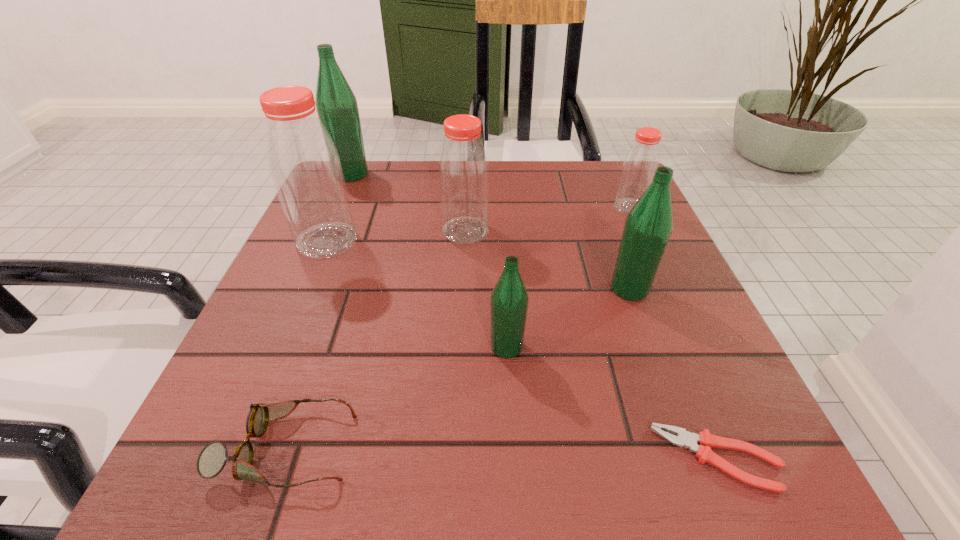
The width and height of the screenshot is (960, 540). In order to click on spectacles in this screenshot , I will do `click(212, 459)`.

You are a GUI agent. You are given a task and a screenshot of the screen. Output one action in this format:
    pyautogui.click(x=<x>, y=<y>)
    Task: Click on the shortest object
    The width and height of the screenshot is (960, 540).
    Given the screenshot: What is the action you would take?
    pyautogui.click(x=706, y=440)

What are the coordinates of `free point located on the right of the farthest object` in the screenshot? It's located at (437, 174).

Where is `vacant area located on the back of the leftmost red bottle`? vacant area located on the back of the leftmost red bottle is located at coordinates (357, 169).

I want to click on vacant area located 0.060m on the right of the second nearest green bottle, so click(683, 289).

The image size is (960, 540). Find the location of `free space located 0.240m on the left of the second biggest red bottle`. free space located 0.240m on the left of the second biggest red bottle is located at coordinates (328, 231).

Image resolution: width=960 pixels, height=540 pixels. I want to click on vacant space located on the front of the seventh nearest object, so click(692, 344).

Identify the location of free spot located on the back of the third nearest object. (501, 244).

The width and height of the screenshot is (960, 540). Identify the location of vacant space located 0.290m on the front-facing side of the spectacles. (572, 448).

Where is `vacant area located 0.320m on the left of the pliers`? Image resolution: width=960 pixels, height=540 pixels. vacant area located 0.320m on the left of the pliers is located at coordinates (409, 458).